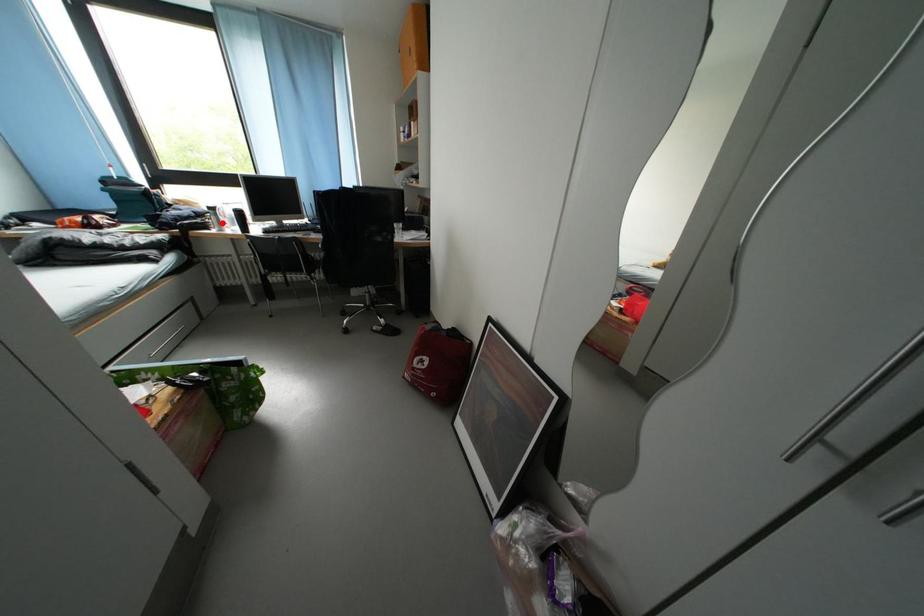
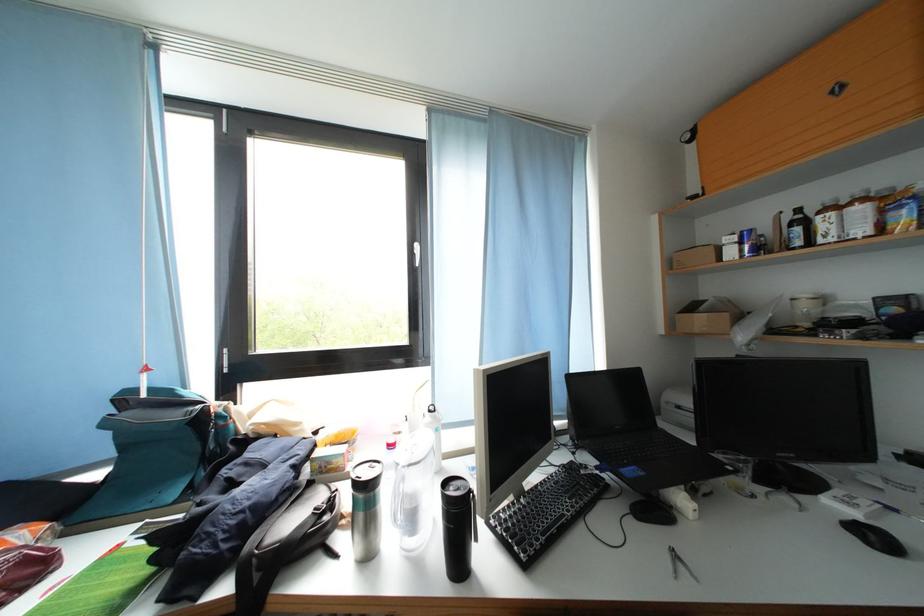
Question: I am providing you with two images of the same scene from different viewpoints. Image1 has a red point marked. In image2, the corresponding 3D location appears at what relative position? Reply with the corresponding letter.

Choices:
 (A) Closer
 (B) Farther

Answer: (B)